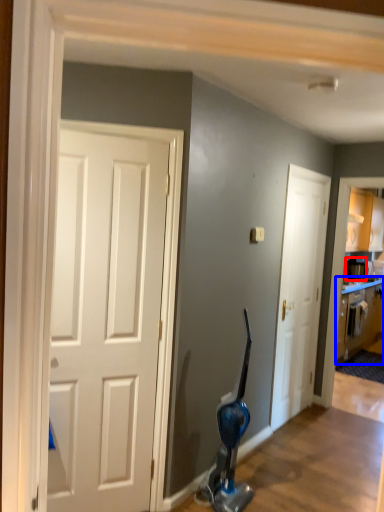
Question: Which object appears closest to the camera in this image, appliance (highlighted by a red box) or cabinetry (highlighted by a blue box)?

Choices:
 (A) appliance
 (B) cabinetry

Answer: (B)